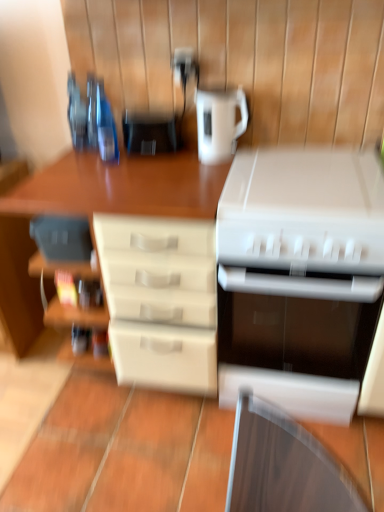
Question: Is matte white drawers at center directly adjacent to white plastic printer at center, which is the first appliance in bottom-to-top order?

Choices:
 (A) no
 (B) yes

Answer: (A)

Question: Is matte white drawers at center turned away from white plastic printer at center, which is the first appliance in bottom-to-top order?

Choices:
 (A) no
 (B) yes

Answer: (A)

Question: Is matte white drawers at center positioned in front of white plastic printer at center, acting as the first appliance starting from the right?

Choices:
 (A) no
 (B) yes

Answer: (A)

Question: Would you consider matte white drawers at center to be distant from white plastic printer at center, which is the first appliance in bottom-to-top order?

Choices:
 (A) no
 (B) yes

Answer: (A)

Question: Does matte white drawers at center have a lesser height compared to white plastic printer at center, acting as the first appliance starting from the right?

Choices:
 (A) yes
 (B) no

Answer: (B)

Question: Visually, is matte black coffee maker at center, the 2th appliance from the bottom, positioned to the left or to the right of white plastic printer at center, acting as the first appliance starting from the right?

Choices:
 (A) left
 (B) right

Answer: (A)

Question: Based on their sizes in the image, would you say matte black coffee maker at center, the 2th appliance from the bottom, is bigger or smaller than white plastic printer at center, the second appliance viewed from the top?

Choices:
 (A) small
 (B) big

Answer: (A)

Question: Is point (145, 129) closer or farther from the camera than point (382, 270)?

Choices:
 (A) closer
 (B) farther

Answer: (B)

Question: Considering the positions of matte black coffee maker at center, which appears as the 1th appliance when viewed from the top, and white plastic printer at center, the second appliance viewed from the top, in the image, is matte black coffee maker at center, which appears as the 1th appliance when viewed from the top, taller or shorter than white plastic printer at center, the second appliance viewed from the top,?

Choices:
 (A) short
 (B) tall

Answer: (A)

Question: Would you say white plastic printer at lower right, placed as the 1th kitchen appliance when sorted from bottom to top, is inside or outside matte black coffee maker at center, which is counted as the first appliance, starting from the left?

Choices:
 (A) inside
 (B) outside

Answer: (B)

Question: Is white plastic printer at lower right, placed as the 1th kitchen appliance when sorted from bottom to top, in front of or behind matte black coffee maker at center, which appears as the 2th appliance when viewed from the right, in the image?

Choices:
 (A) front
 (B) behind

Answer: (A)

Question: In terms of width, does white plastic printer at lower right, placed as the 1th kitchen appliance when sorted from bottom to top, look wider or thinner when compared to matte black coffee maker at center, which appears as the 2th appliance when viewed from the right?

Choices:
 (A) wide
 (B) thin

Answer: (A)

Question: In the image, is white plastic printer at lower right, placed as the 1th kitchen appliance when sorted from bottom to top, on the left side or the right side of matte black coffee maker at center, which appears as the 1th appliance when viewed from the top?

Choices:
 (A) right
 (B) left

Answer: (A)

Question: Considering their positions, is matte white drawers at center located in front of or behind white glossy kettle at upper center, the 2th kitchen appliance ordered from the bottom?

Choices:
 (A) front
 (B) behind

Answer: (A)

Question: In terms of size, does matte white drawers at center appear bigger or smaller than white glossy kettle at upper center, the 2th kitchen appliance ordered from the bottom?

Choices:
 (A) small
 (B) big

Answer: (B)